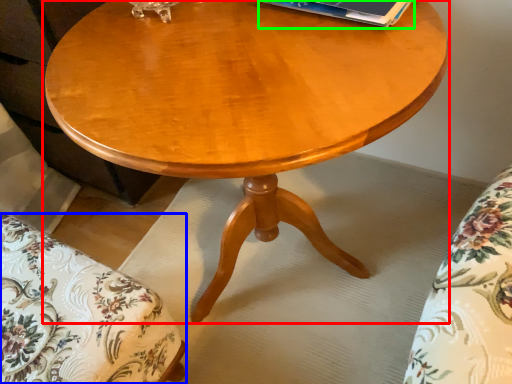
Question: Which is farther away from coffee table (highlighted by a red box)? swivel chair (highlighted by a blue box) or paperback book (highlighted by a green box)?

Choices:
 (A) swivel chair
 (B) paperback book

Answer: (A)